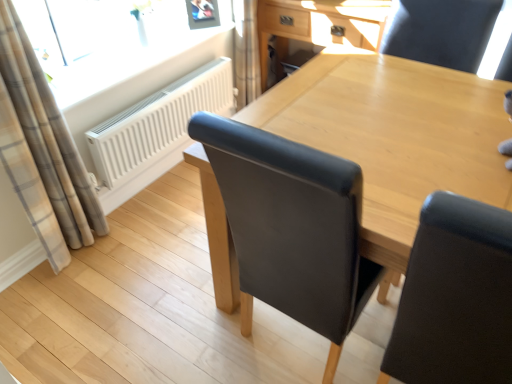
Where is `blank area beneath plaid fabric curtain at left (from a real-world perspective)`? The width and height of the screenshot is (512, 384). blank area beneath plaid fabric curtain at left (from a real-world perspective) is located at coordinates (79, 256).